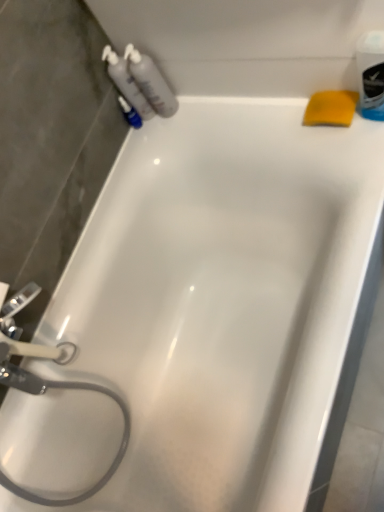
Where is `vacant space that is in between translucent plastic bottles at upper left, positioned as the first cleaning product in right-to-left order, and yellow sponge at upper right`? vacant space that is in between translucent plastic bottles at upper left, positioned as the first cleaning product in right-to-left order, and yellow sponge at upper right is located at coordinates (243, 111).